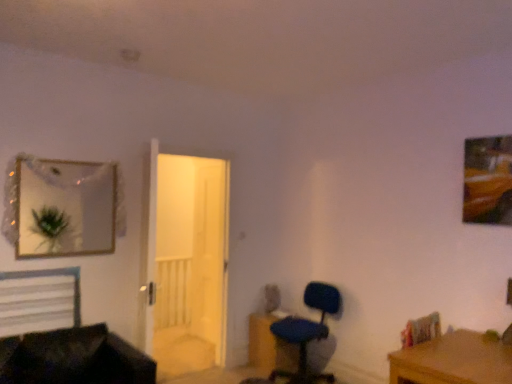
Locate an element on the screen. free space above white wooden door at center (from a real-world perspective) is located at coordinates (190, 142).